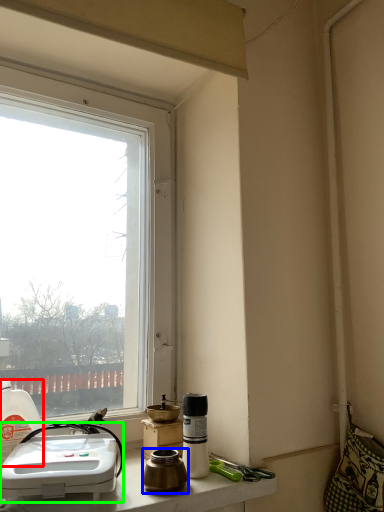
Question: Based on their relative distances, which object is farther from bottle (highlighted by a red box)? Choose from coffee cup (highlighted by a blue box) and sink (highlighted by a green box).

Choices:
 (A) coffee cup
 (B) sink

Answer: (A)